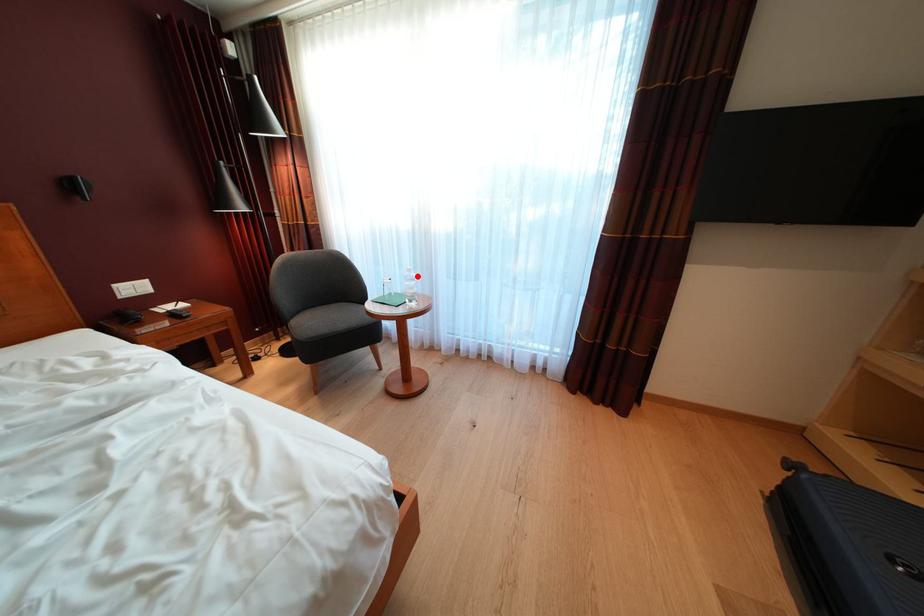
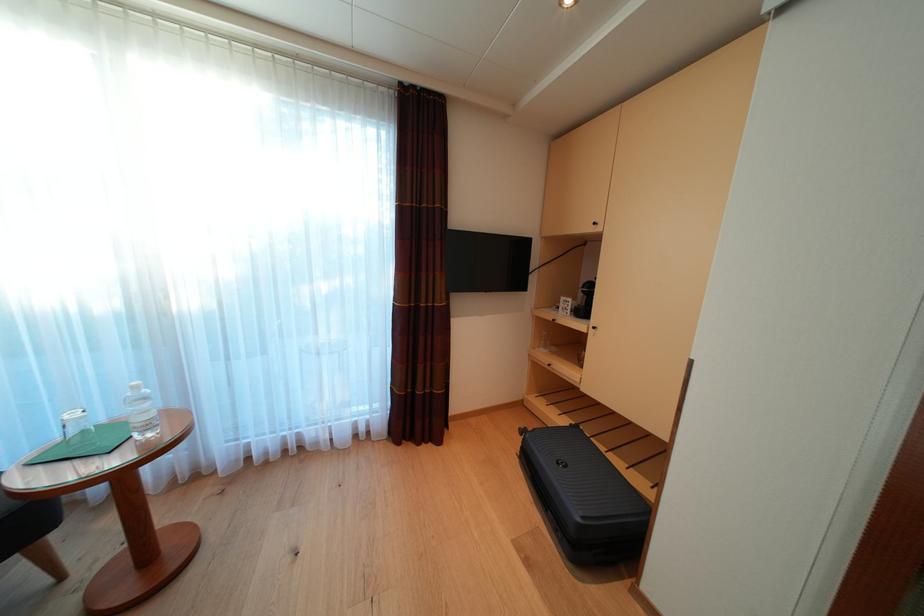
In the second image, find the point that corresponds to the highlighted location in the first image.

(144, 392)